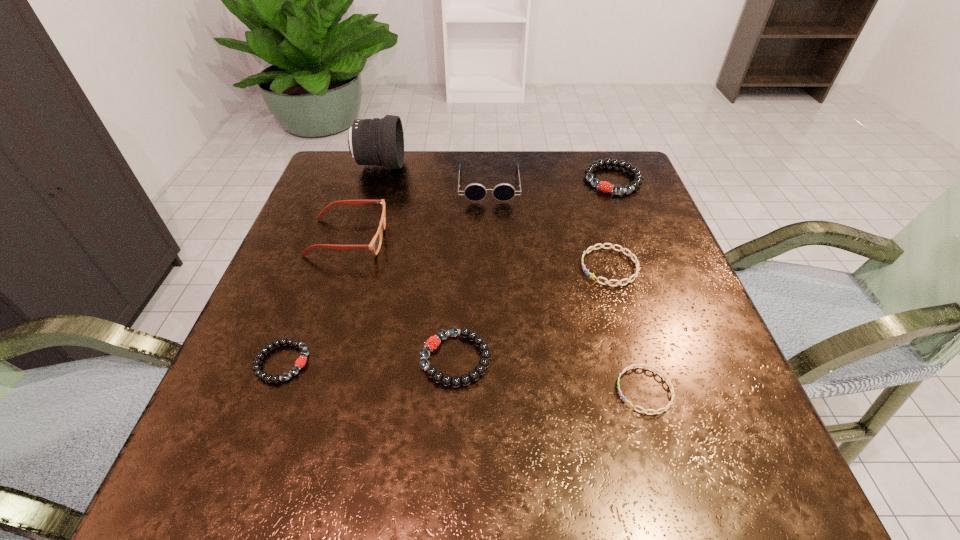
This screenshot has width=960, height=540. What are the coordinates of `spectacles located at the left edge` in the screenshot? It's located at (x=375, y=244).

I want to click on bracelet at the left edge, so click(x=301, y=361).

What are the coordinates of `object that is at the far left corner` in the screenshot? It's located at 376,141.

Where is `object that is at the far right corner`? The image size is (960, 540). object that is at the far right corner is located at coordinates pos(604,186).

What are the coordinates of `vacant region at the far edge of the desktop` in the screenshot? It's located at (511, 156).

The width and height of the screenshot is (960, 540). I want to click on free space at the left edge of the desktop, so click(276, 283).

In the image, there is a desktop. Where is `free space at the right edge`? Image resolution: width=960 pixels, height=540 pixels. free space at the right edge is located at coordinates (683, 428).

In the image, there is a desktop. Identify the location of vacant space at the far left corner. (326, 170).

The width and height of the screenshot is (960, 540). I want to click on free region at the far right corner, so click(x=603, y=167).

You are a GUI agent. You are given a task and a screenshot of the screen. Output one action in this format:
    pyautogui.click(x=<x>, y=<y>)
    Task: Click on the free point at the near right corner
    
    Given the screenshot: What is the action you would take?
    pyautogui.click(x=697, y=448)